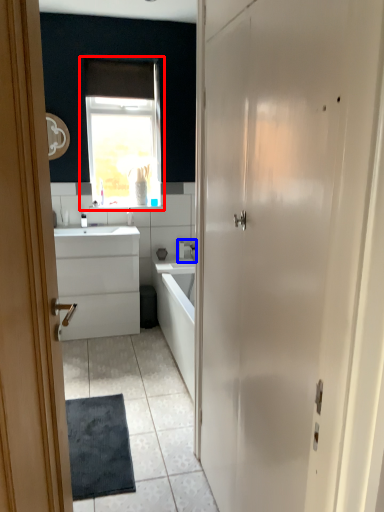
Question: Among these objects, which one is nearest to the camera, window (highlighted by a red box) or tap (highlighted by a blue box)?

Choices:
 (A) window
 (B) tap

Answer: (A)